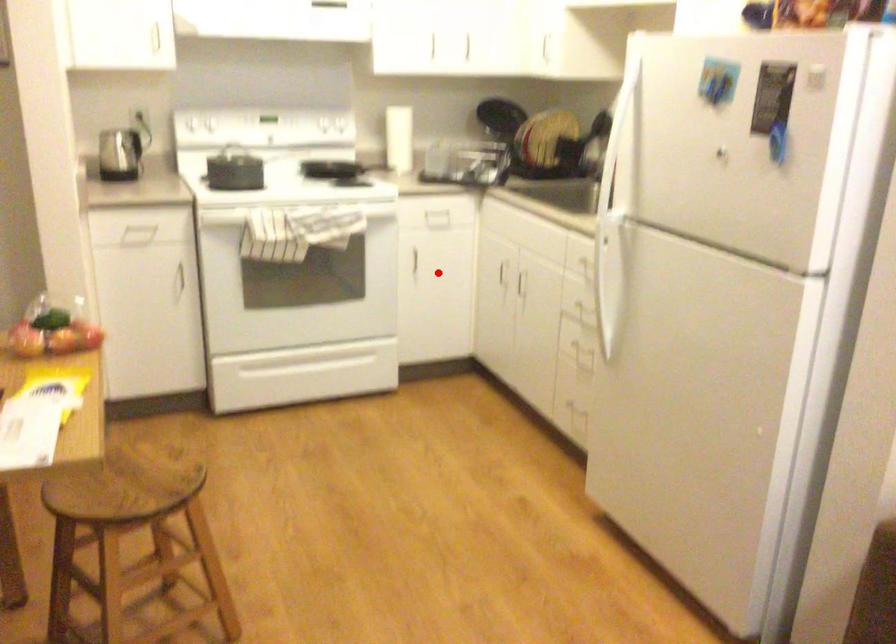
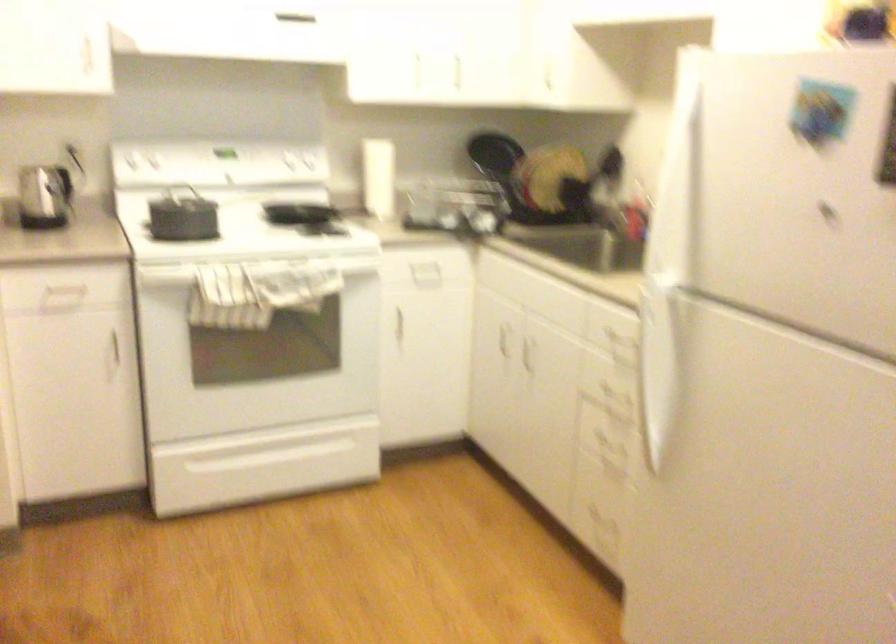
The point at the highlighted location is marked in the first image. Where is the corresponding point in the second image?

(425, 342)